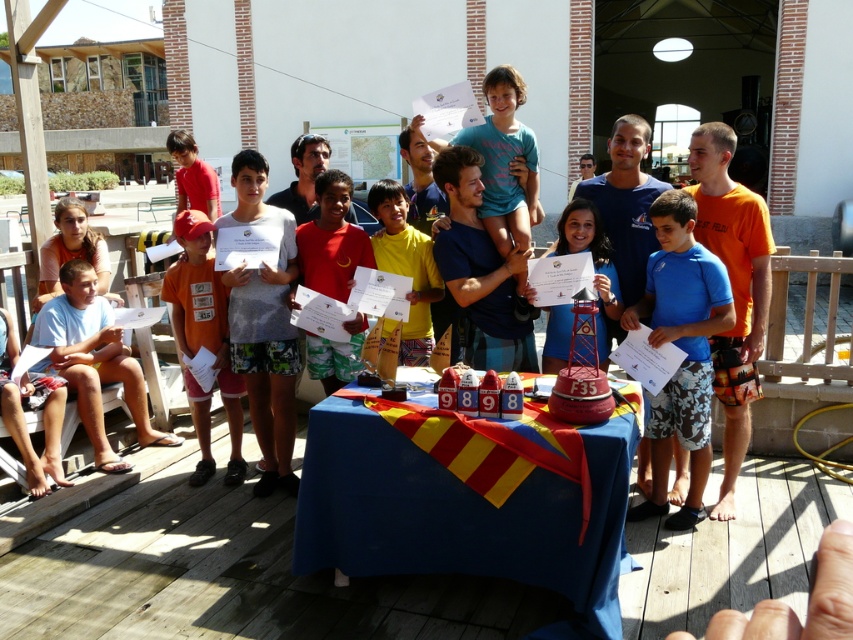
You are organizing a photo shoot and need to ensure that the blue fabric at center and the matte blue shirt at center are both visible in the frame. Given their sizes, which object should you prioritize positioning closer to the camera to ensure it doesn not get obscured by the other?

The blue fabric at center is wider than the matte blue shirt at center, so you should position the matte blue shirt at center closer to the camera to prevent it from being obscured by the wider blue fabric at center.

You are standing on the wooden deck where the celebration is happening. There is a point marked at coordinates (x=680, y=348). What object is located at that point?

The point at coordinates (x=680, y=348) corresponds to the blue floral shorts at center.